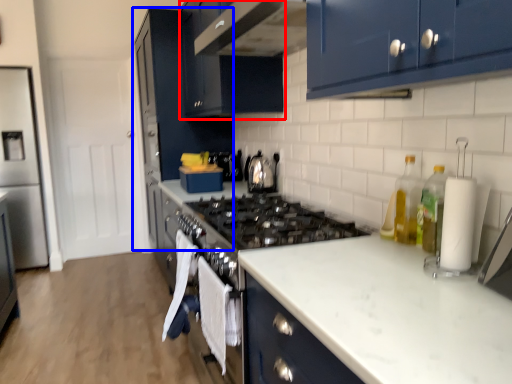
Question: Which of the following is the farthest to the observer, cabinetry (highlighted by a red box) or cabinetry (highlighted by a blue box)?

Choices:
 (A) cabinetry
 (B) cabinetry

Answer: (B)